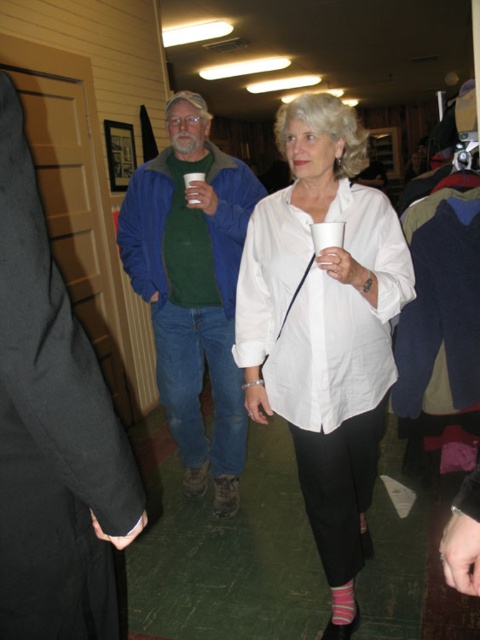
Question: Can you confirm if matte blue jacket at center is smaller than pink striped sock at lower center?

Choices:
 (A) yes
 (B) no

Answer: (B)

Question: Which object appears farthest from the camera in this image?

Choices:
 (A) white matte shirt at center
 (B) white paper cup at center
 (C) blue fleece jacket at center
 (D) matte blue jacket at center

Answer: (C)

Question: Which of the following is the closest to the observer?

Choices:
 (A) white matte shirt at center
 (B) blue fleece jacket at center

Answer: (A)

Question: Which point is closer to the camera?

Choices:
 (A) (47, 506)
 (B) (377, 195)
 (C) (195, 172)

Answer: (A)

Question: Does white matte shirt at center appear on the left side of pink striped sock at lower center?

Choices:
 (A) yes
 (B) no

Answer: (A)

Question: In this image, where is blue fleece jacket at center located relative to pink striped sock at lower center?

Choices:
 (A) left
 (B) right

Answer: (A)